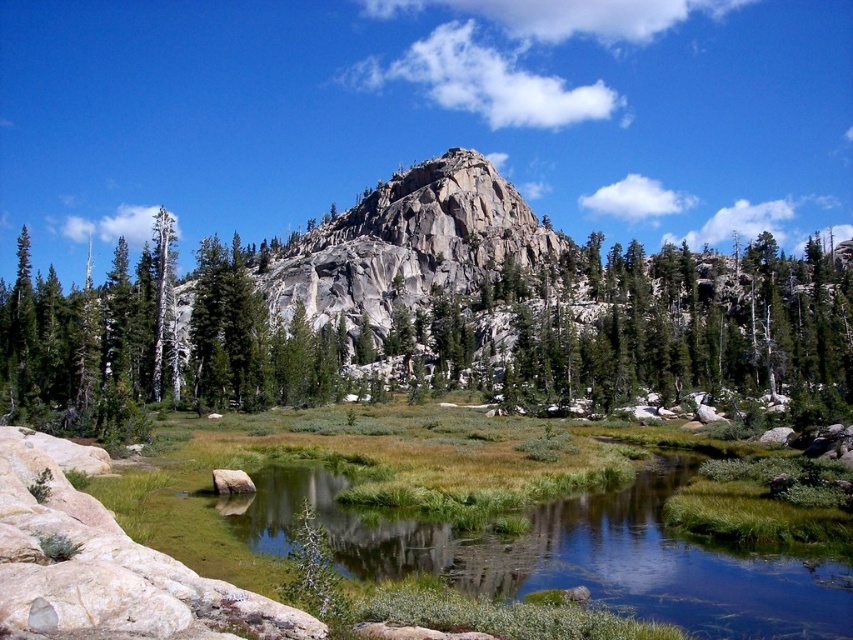
Does green grassy lake at center appear over smooth gray rock at center?

Incorrect, green grassy lake at center is not positioned above smooth gray rock at center.

Is green grassy lake at center thinner than smooth gray rock at center?

Incorrect, green grassy lake at center's width is not less than smooth gray rock at center's.

Where is `green grassy lake at center`? This screenshot has height=640, width=853. green grassy lake at center is located at coordinates (566, 556).